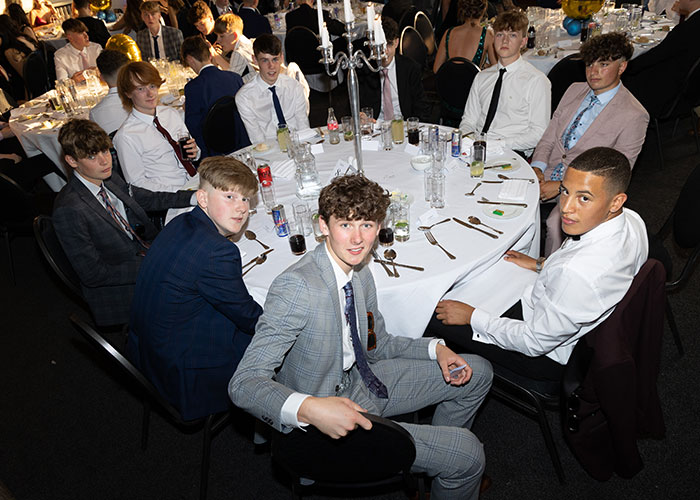
Where is `chair`? chair is located at coordinates (122, 373), (54, 260), (411, 420), (533, 397), (453, 78), (410, 58), (426, 20), (564, 76), (658, 252), (344, 467).